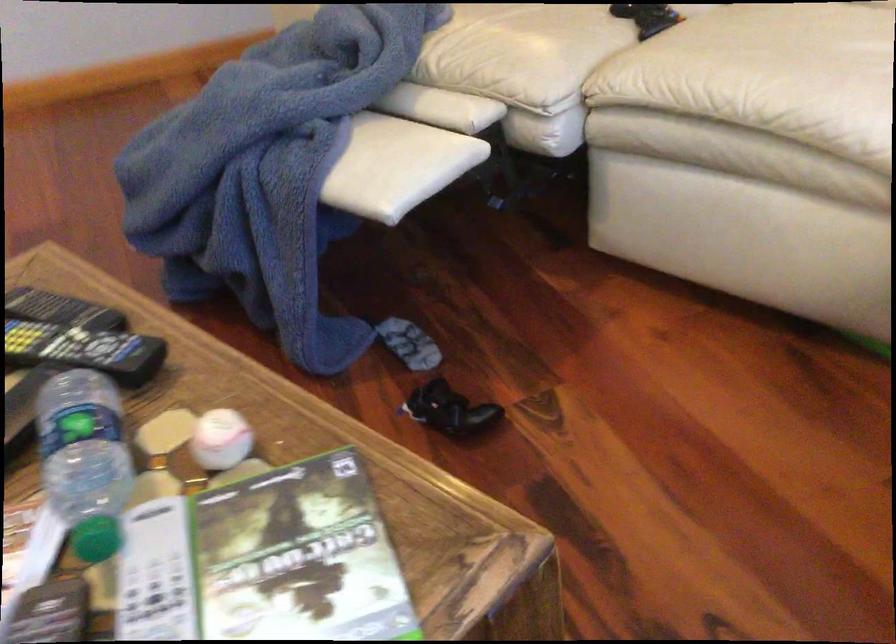
What do you see at coordinates (298, 556) in the screenshot?
I see `the green video game case` at bounding box center [298, 556].